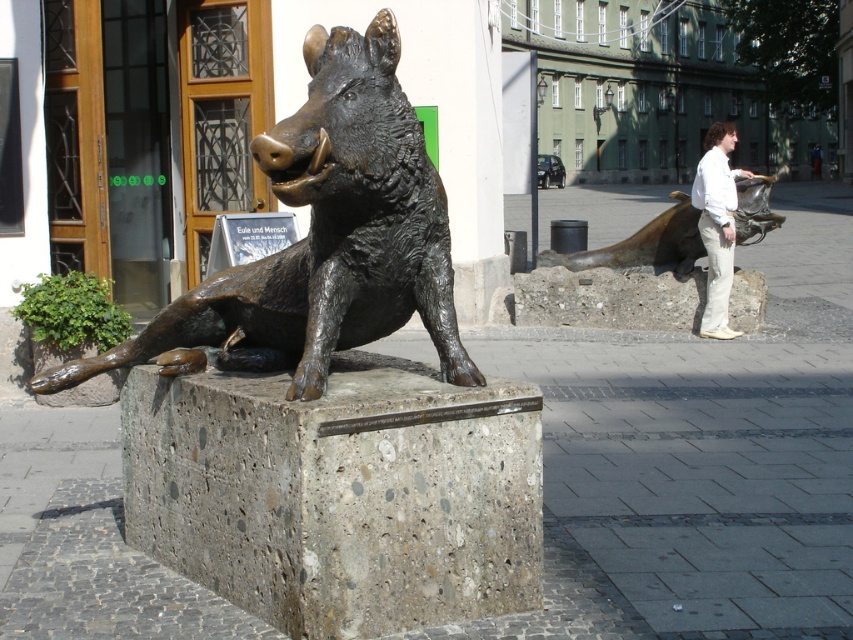
Who is more distant from viewer, (335, 42) or (607, 259)?

The point (607, 259) is behind.

Does bronze statue of a boar at center have a greater height compared to bronze statue at right?

Yes.

At what (x,y) coordinates should I click in order to perform the action: click on bronze statue of a boar at center. Please return your answer as a coordinate pair (x, y). This screenshot has width=853, height=640. Looking at the image, I should click on click(322, 237).

Who is positioned more to the right, bronze statue at right or white cotton pants at right?

white cotton pants at right is more to the right.

Looking at this image, can you confirm if bronze statue at right is positioned to the right of white cotton pants at right?

In fact, bronze statue at right is to the left of white cotton pants at right.

Describe the element at coordinates (643, 243) in the screenshot. I see `bronze statue at right` at that location.

You are a GUI agent. You are given a task and a screenshot of the screen. Output one action in this format:
    pyautogui.click(x=<x>, y=<y>)
    Task: Click on the bronze statue at right
    This screenshot has width=853, height=640.
    Given the screenshot: What is the action you would take?
    pyautogui.click(x=643, y=243)

Who is higher up, bronze statue of a boar at center or white cotton pants at right?

white cotton pants at right

Can you confirm if bronze statue of a boar at center is bigger than white cotton pants at right?

Indeed, bronze statue of a boar at center has a larger size compared to white cotton pants at right.

What do you see at coordinates (322, 237) in the screenshot? The width and height of the screenshot is (853, 640). I see `bronze statue of a boar at center` at bounding box center [322, 237].

Locate an element on the screen. bronze statue of a boar at center is located at coordinates (322, 237).